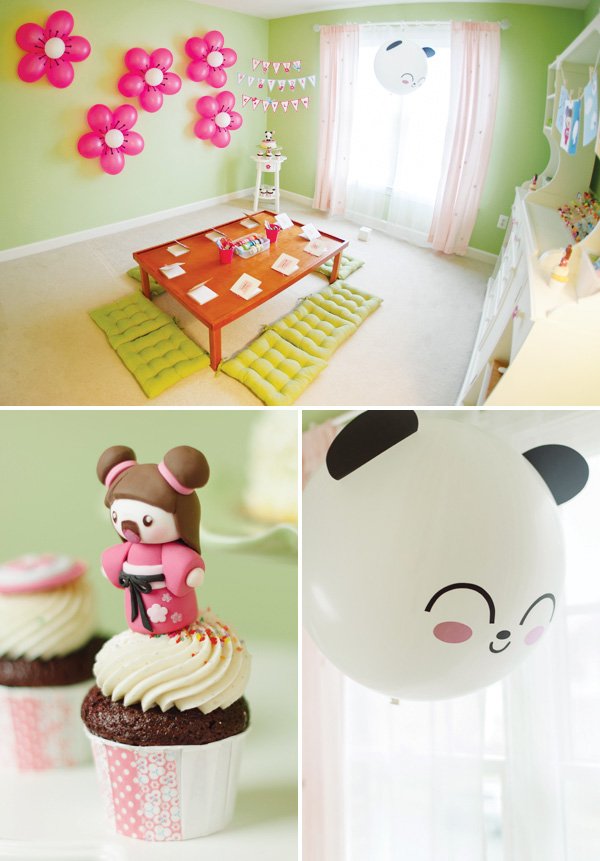
Locate an element on the screen. pastel green throw pillows is located at coordinates (339, 298), (307, 330), (291, 375), (157, 364), (121, 321).